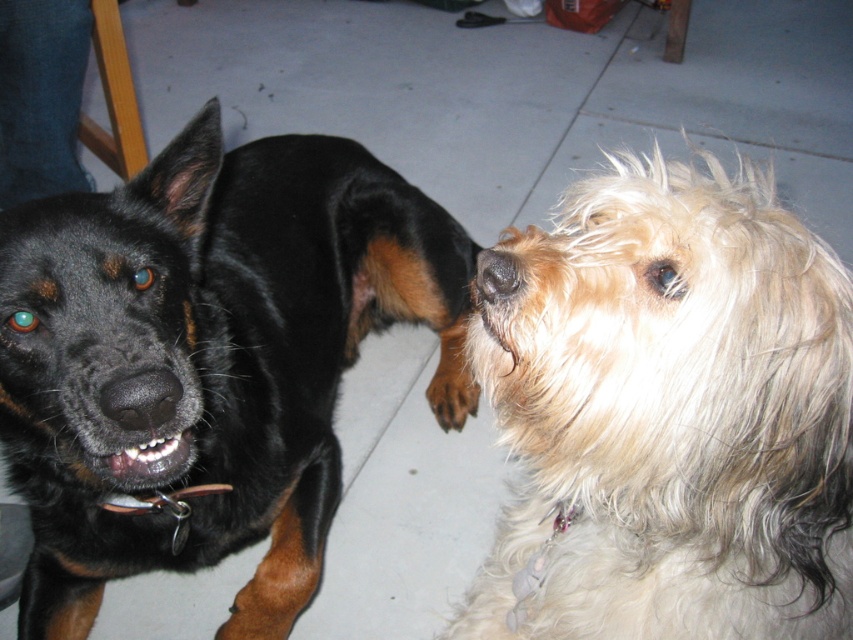
Is point (131, 374) closer to viewer compared to point (477, 285)?

No, it is not.

What do you see at coordinates (141, 397) in the screenshot? This screenshot has width=853, height=640. I see `black matte nose at center` at bounding box center [141, 397].

Locate an element on the screen. The image size is (853, 640). black matte nose at center is located at coordinates (141, 397).

In the scene shown: Is fluffy beige dog at right above brown fuzzy nose at center?

Incorrect, fluffy beige dog at right is not positioned above brown fuzzy nose at center.

Is fluffy beige dog at right to the right of brown fuzzy nose at center from the viewer's perspective?

Correct, you'll find fluffy beige dog at right to the right of brown fuzzy nose at center.

Does point (541, 280) lie in front of point (511, 268)?

That is True.

Where is `fluffy beige dog at right`? The width and height of the screenshot is (853, 640). fluffy beige dog at right is located at coordinates (670, 416).

Can you confirm if black matte nose at center is positioned below brown fur paw at center?

No.

Does black matte nose at center appear over brown fur paw at center?

Yes, black matte nose at center is above brown fur paw at center.

Is point (178, 396) farther from camera compared to point (437, 369)?

That is False.

Locate an element on the screen. The width and height of the screenshot is (853, 640). black matte nose at center is located at coordinates (141, 397).